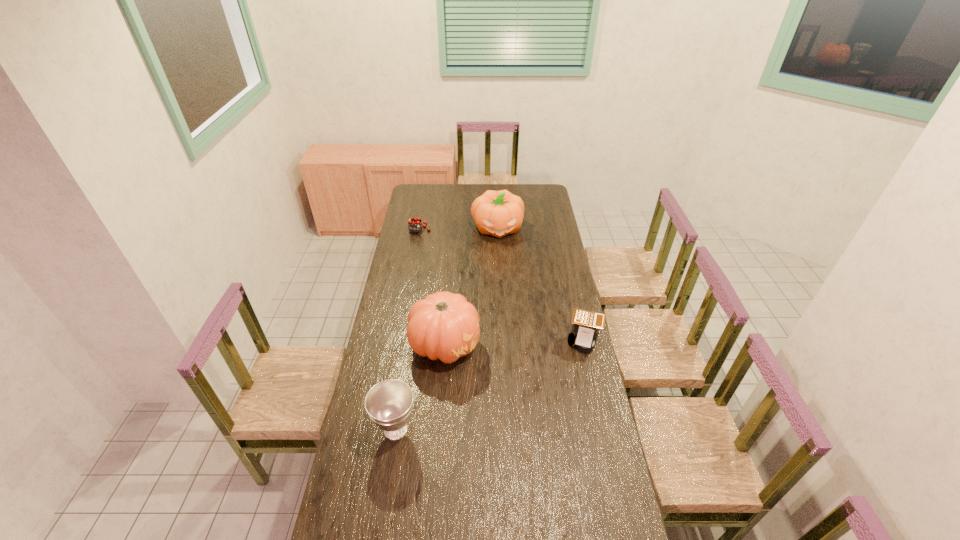
Identify the location of object that is at the right edge. The width and height of the screenshot is (960, 540). [x=586, y=324].

Identify the location of free region at the far edge of the desktop. Image resolution: width=960 pixels, height=540 pixels. (458, 186).

Where is `vacant space at the near edge`? vacant space at the near edge is located at coordinates (414, 524).

The image size is (960, 540). What are the coordinates of `free point at the left edge` in the screenshot? It's located at (427, 241).

Where is `free space at the right edge`? This screenshot has width=960, height=540. free space at the right edge is located at coordinates pyautogui.click(x=564, y=397).

I want to click on free space between the pot filled with cherries and the nearer pumpkin, so click(432, 287).

Image resolution: width=960 pixels, height=540 pixels. Identify the location of vacant space that is in between the farther pumpkin and the rightmost object. (541, 284).

Where is `vacant space in between the farther pumpkin and the nearer pumpkin`? This screenshot has height=540, width=960. vacant space in between the farther pumpkin and the nearer pumpkin is located at coordinates (471, 286).

At what (x,y) coordinates should I click in order to perform the action: click on free space between the nearer pumpkin and the farther pumpkin. Please return your answer as a coordinate pair (x, y). The width and height of the screenshot is (960, 540). Looking at the image, I should click on (471, 286).

Find the location of `empty space that is in between the farther pumpkin and the calculator`. empty space that is in between the farther pumpkin and the calculator is located at coordinates (541, 284).